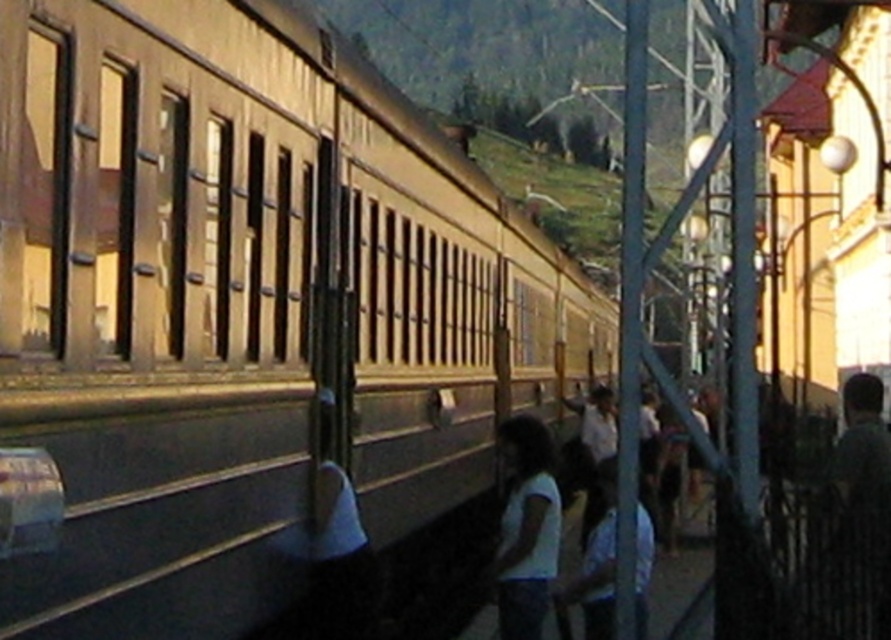
You are a photographer trying to capture the crowd on the platform. You notice two people wearing distinct shirts. The dark green shirt at right and the white fabric shirt at center. Which shirt is smaller in size when viewed from your current position?

The dark green shirt at right occupies less space than the white fabric shirt at center, so the dark green shirt at right appears smaller in size when viewed from your current position.

You are a photographer standing on the platform at the train station. You want to take a photo of the white matte shirt at lower center and the dark green shirt at right. Which of the two shirts should you focus on first if you want to capture the one that appears bigger in your photo?

The white matte shirt at lower center is larger in size than the dark green shirt at right, so you should focus on the white matte shirt at lower center first to capture the bigger one in your photo.

You are standing on the platform of the train station and see two people wearing a white matte shirt at lower center and a dark green shirt at right. Which person is standing closer to the left side of the platform?

The white matte shirt at lower center is positioned on the left side of dark green shirt at right, so the person wearing the white matte shirt at lower center is standing closer to the left side of the platform.